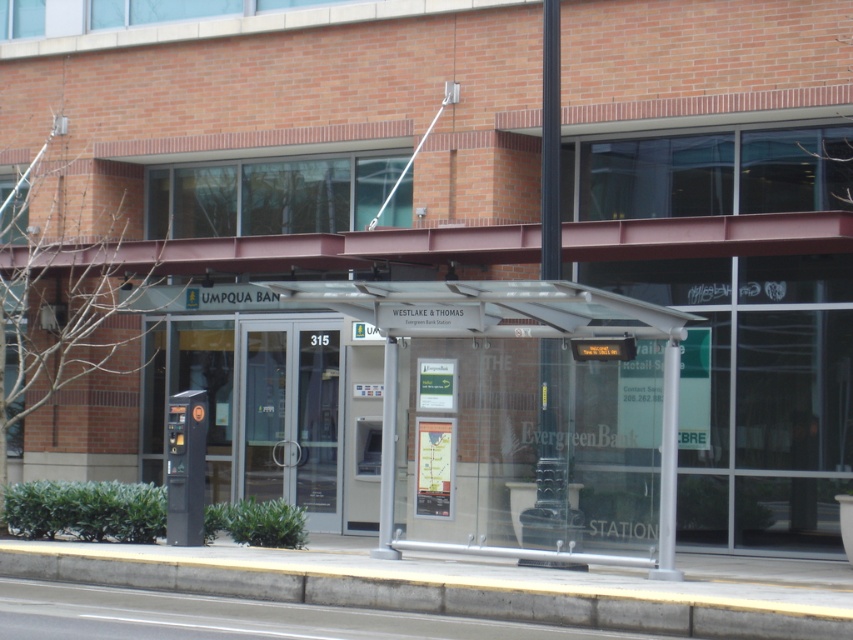
You are standing at the Westlake and Thomas station transit shelter. You notice two points marked on the digital display board. The first point is at coordinate point (277, 465) and the second is at point (196, 474). If you want to touch the point that is closer to you, which coordinate should you aim for?

Point (196, 474) is closer to you because it is less further to the camera than point (277, 465) according to the description.

You are a passenger approaching the Westlake and Thomas station and need to enter the brick building through the clear glass doors at center. Based on the scene description, which direction should you walk relative to the gray concrete curb at lower center to reach the doors?

You should walk towards the gray concrete curb at lower center because it is in front of the clear glass doors at center, so moving towards it will lead you directly to the doors.